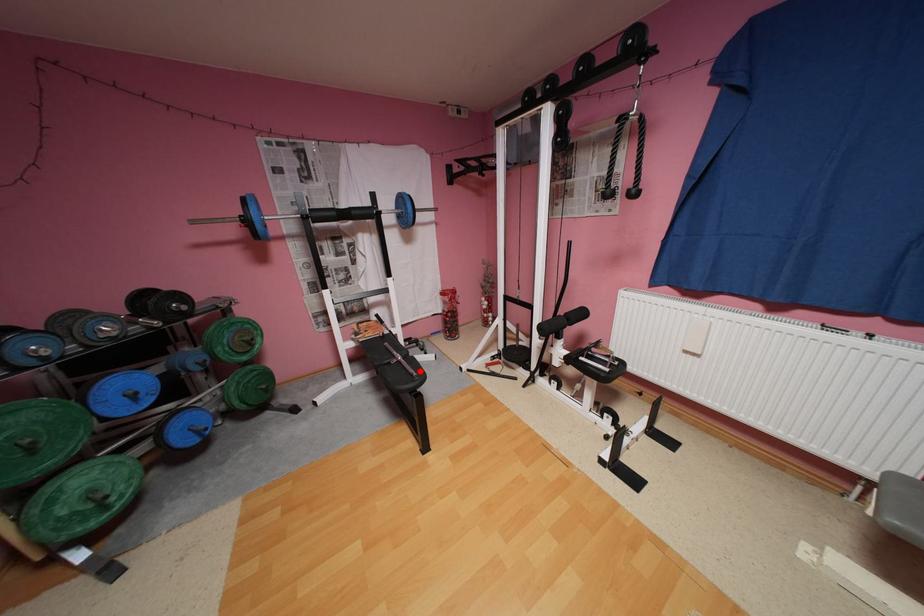
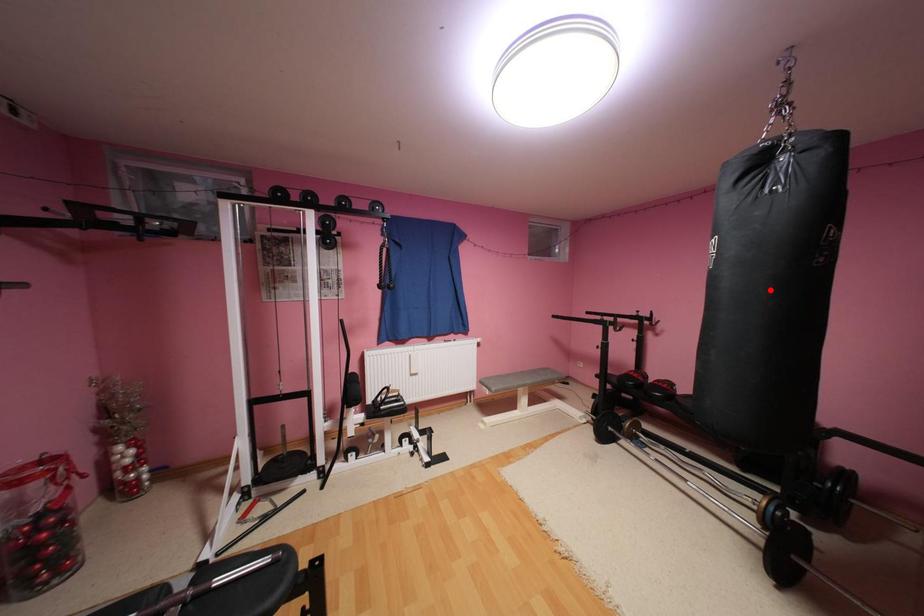
I am providing you with two images of the same scene from different viewpoints. A red point is marked on the first image and another point is marked on the second image. Do the highlighted points in image1 and image2 indicate the same real-world spot?

No